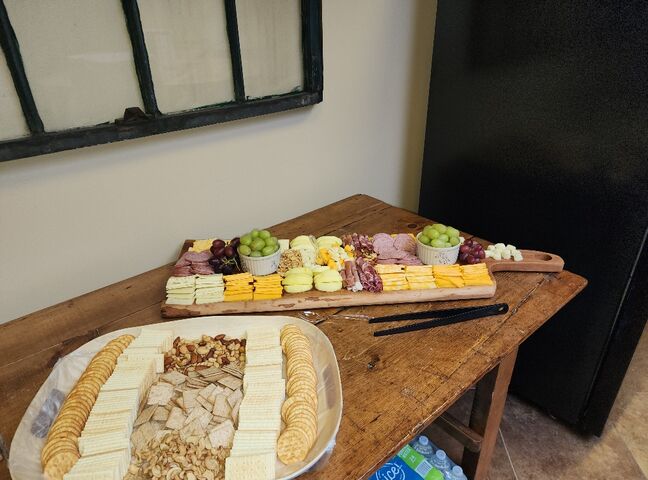
You are a GUI agent. You are given a task and a screenshot of the screen. Output one action in this format:
    pyautogui.click(x=<x>, y=<y>)
    Task: Click on the cheese board
    
    Given the screenshot: What is the action you would take?
    pyautogui.click(x=350, y=298)